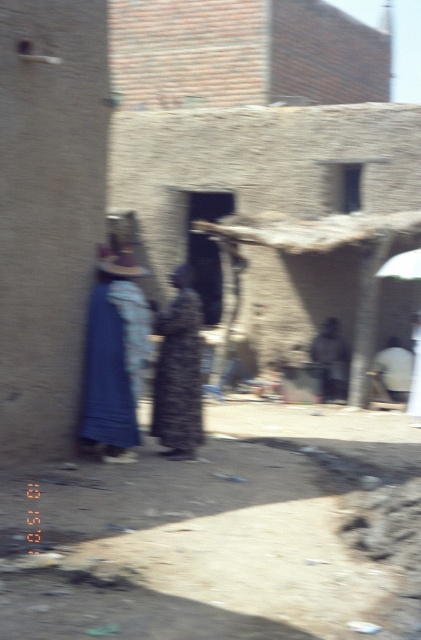
Between point (20, 554) and point (394, 259), which one is positioned behind?

Point (394, 259)

Who is taller, brown fabric at lower center or white fabric umbrella at upper right?

Standing taller between the two is white fabric umbrella at upper right.

Between point (253, 426) and point (399, 253), which one is positioned behind?

The point (399, 253) is behind.

This screenshot has height=640, width=421. In order to click on brown fabric at lower center in this screenshot , I will do tap(226, 534).

How far apart are brown fabric at lower center and printed fabric dress at center?

A distance of 10.33 feet exists between brown fabric at lower center and printed fabric dress at center.

Does brown fabric at lower center have a lesser height compared to printed fabric dress at center?

Yes.

Which is behind, point (405, 618) or point (186, 436)?

Positioned behind is point (186, 436).

I want to click on brown fabric at lower center, so click(226, 534).

Between brown fabric at lower center and blue fabric dress at center, which one appears on the right side from the viewer's perspective?

From the viewer's perspective, brown fabric at lower center appears more on the right side.

Is brown fabric at lower center smaller than blue fabric dress at center?

Yes.

Who is more forward, (319, 512) or (119, 416)?

Point (319, 512) is in front.

This screenshot has height=640, width=421. Find the location of `brown fabric at lower center`. brown fabric at lower center is located at coordinates (226, 534).